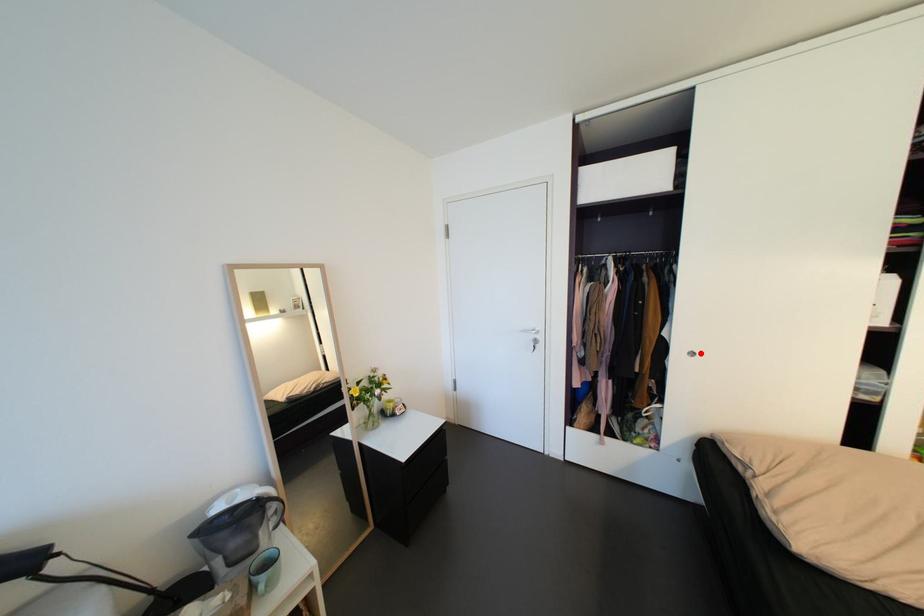
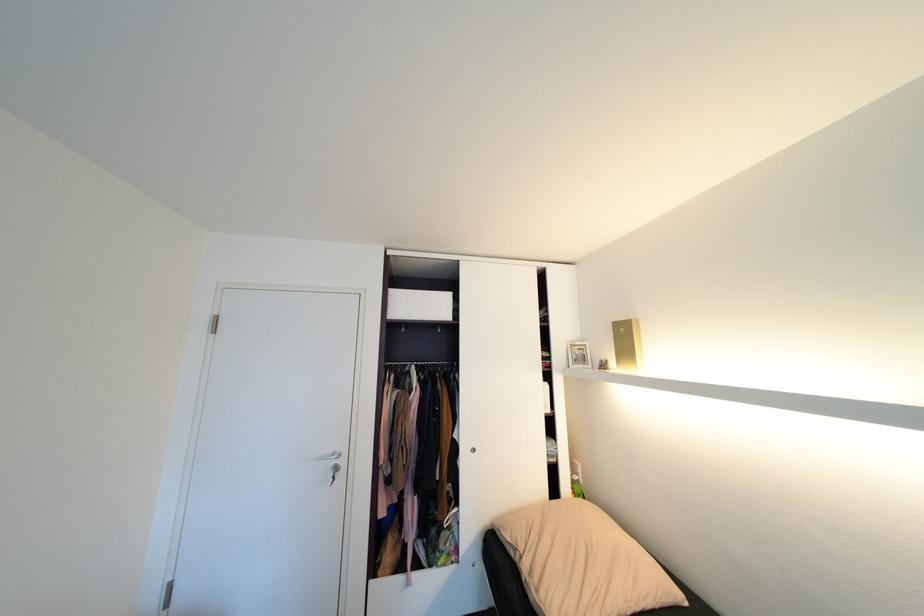
Question: I am providing you with two images of the same scene from different viewpoints. In image1, a red point is highlighted. Considering the same 3D point in image2, which of the following is correct?

Choices:
 (A) It is closer
 (B) It is farther

Answer: (B)